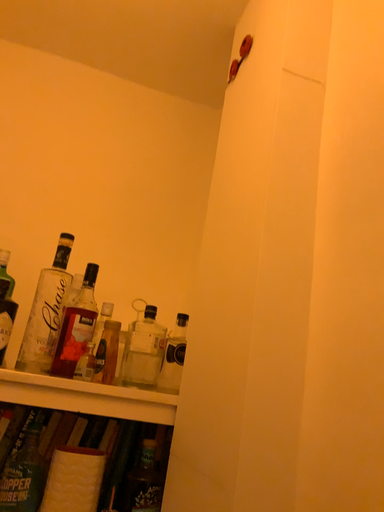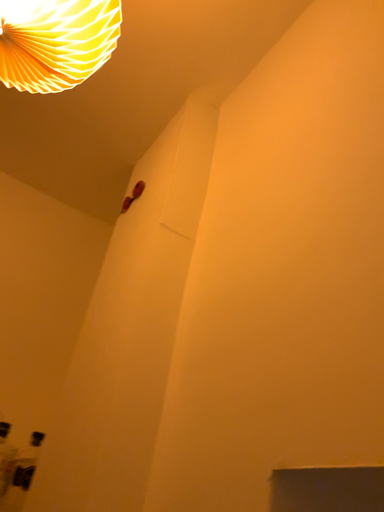
Question: How did the camera likely rotate when shooting the video?

Choices:
 (A) rotated downward
 (B) rotated upward

Answer: (B)